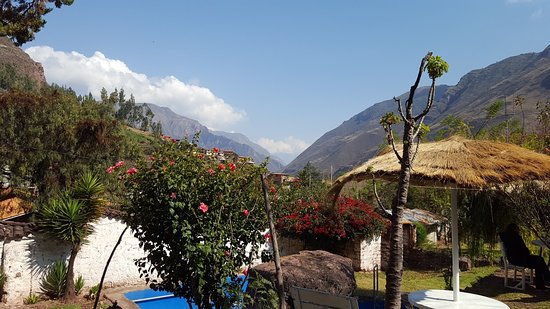
What are the coordinates of `round table` in the screenshot? It's located at (436, 297).